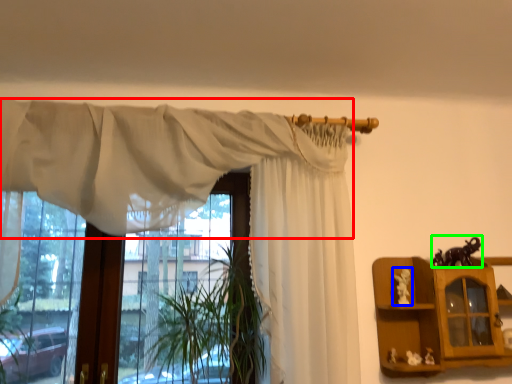
Question: Which object is positioned closest to curtain (highlighted by a red box)? Select from toy (highlighted by a blue box) and toy (highlighted by a green box).

Choices:
 (A) toy
 (B) toy

Answer: (A)